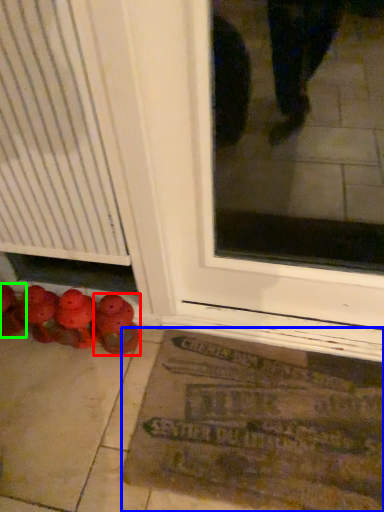
Question: Which is farther away from footwear (highlighted by a red box)? bath mat (highlighted by a blue box) or footwear (highlighted by a green box)?

Choices:
 (A) bath mat
 (B) footwear

Answer: (A)